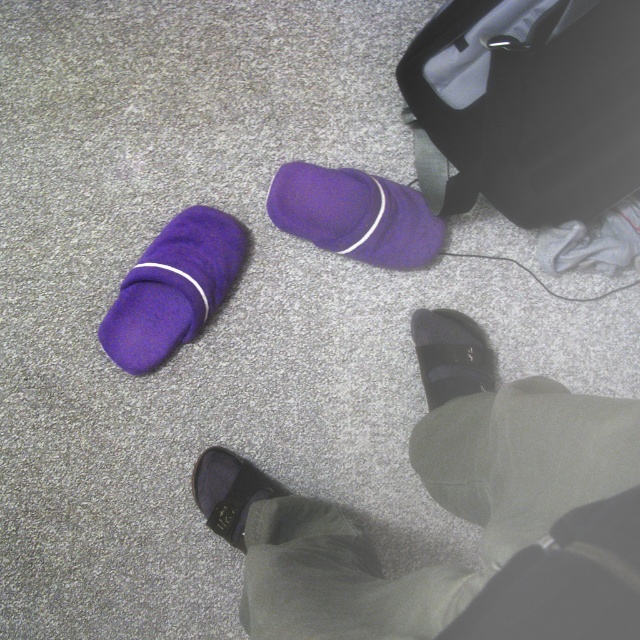
Question: Is purple fleece slipper at upper left in front of velvet black slipper at lower center?

Choices:
 (A) yes
 (B) no

Answer: (A)

Question: In this image, where is matte black suitcase at upper right located relative to velvet black slipper at lower center?

Choices:
 (A) left
 (B) right

Answer: (B)

Question: Considering the real-world distances, which object is closest to the matte black suitcase at upper right?

Choices:
 (A) purple fleece slipper at upper left
 (B) black leather sandals at lower center

Answer: (B)

Question: Which object is the closest to the black leather sandals at lower center?

Choices:
 (A) black matte shoe at lower center
 (B) matte black suitcase at upper right
 (C) purple fleece sock at center

Answer: (A)

Question: Which of the following is the closest to the observer?

Choices:
 (A) (522, 593)
 (B) (225, 532)
 (C) (428, 220)
 (D) (212, 272)

Answer: (A)

Question: Is matte black suitcase at upper right positioned behind purple fleece sock at center?

Choices:
 (A) no
 (B) yes

Answer: (A)